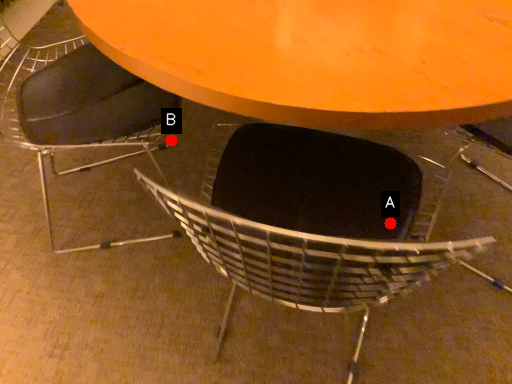
Question: Two points are circled on the image, labeled by A and B beside each circle. Which point is closer to the camera taking this photo?

Choices:
 (A) A is closer
 (B) B is closer

Answer: (A)